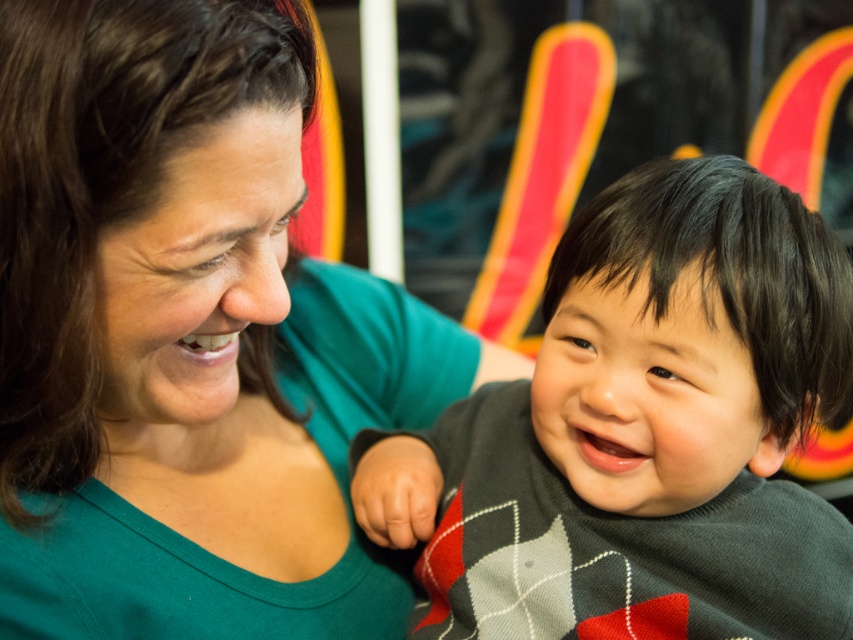
Question: Does green matte shirt at center come in front of dark gray sweater at center?

Choices:
 (A) yes
 (B) no

Answer: (A)

Question: Is green matte shirt at center thinner than dark gray sweater at center?

Choices:
 (A) yes
 (B) no

Answer: (A)

Question: Which point appears closest to the camera in this image?

Choices:
 (A) (732, 266)
 (B) (160, 385)

Answer: (A)

Question: Among these points, which one is nearest to the camera?

Choices:
 (A) (343, 406)
 (B) (746, 532)

Answer: (B)

Question: Can you confirm if green matte shirt at center is positioned to the left of dark gray sweater at center?

Choices:
 (A) yes
 (B) no

Answer: (A)